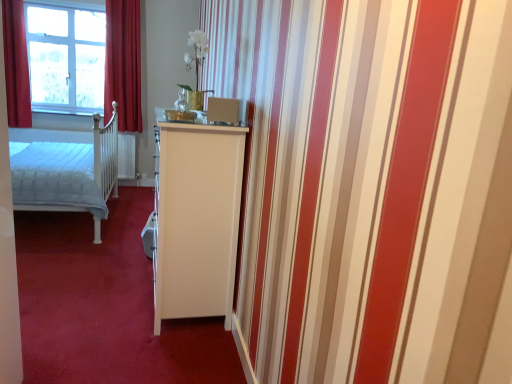
Question: Considering the relative sizes of white glossy cabinet at center and clear glass window at upper left in the image provided, is white glossy cabinet at center shorter than clear glass window at upper left?

Choices:
 (A) yes
 (B) no

Answer: (A)

Question: Is white glossy cabinet at center directly adjacent to clear glass window at upper left?

Choices:
 (A) yes
 (B) no

Answer: (B)

Question: Is the position of white glossy cabinet at center more distant than that of clear glass window at upper left?

Choices:
 (A) no
 (B) yes

Answer: (A)

Question: Considering the relative sizes of white glossy cabinet at center and clear glass window at upper left in the image provided, is white glossy cabinet at center smaller than clear glass window at upper left?

Choices:
 (A) no
 (B) yes

Answer: (A)

Question: Is white glossy cabinet at center at the left side of clear glass window at upper left?

Choices:
 (A) yes
 (B) no

Answer: (B)

Question: Is white glossy cabinet at center taller or shorter than red velvet curtain at left, marked as the first curtain in a left-to-right arrangement?

Choices:
 (A) tall
 (B) short

Answer: (B)

Question: Is white glossy cabinet at center in front of or behind red velvet curtain at left, which appears as the second curtain when viewed from the right, in the image?

Choices:
 (A) behind
 (B) front

Answer: (B)

Question: Would you say white glossy cabinet at center is to the left or to the right of red velvet curtain at left, which appears as the second curtain when viewed from the right, in the picture?

Choices:
 (A) left
 (B) right

Answer: (B)

Question: Is white glossy cabinet at center spatially inside red velvet curtain at left, marked as the first curtain in a left-to-right arrangement, or outside of it?

Choices:
 (A) inside
 (B) outside

Answer: (B)

Question: Is white glossy cabinet at center wider or thinner than white quilted fabric bed at left?

Choices:
 (A) wide
 (B) thin

Answer: (A)

Question: Relative to white quilted fabric bed at left, is white glossy cabinet at center in front or behind?

Choices:
 (A) behind
 (B) front

Answer: (B)

Question: From a real-world perspective, is white glossy cabinet at center positioned above or below white quilted fabric bed at left?

Choices:
 (A) below
 (B) above

Answer: (A)

Question: From the image's perspective, is white glossy cabinet at center located above or below white quilted fabric bed at left?

Choices:
 (A) above
 (B) below

Answer: (B)

Question: Does point [71, 261] appear closer or farther from the camera than point [138, 129]?

Choices:
 (A) closer
 (B) farther

Answer: (A)

Question: Would you say white glossy cabinet at center is to the left or to the right of velvet red curtain at upper left, the second curtain positioned from the left, in the picture?

Choices:
 (A) right
 (B) left

Answer: (A)